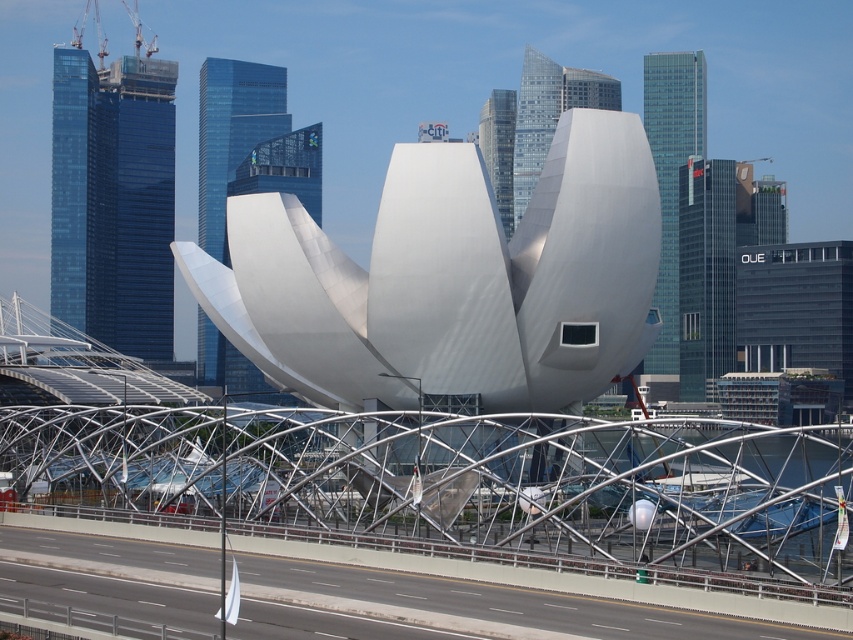
Is metallic silver bridge at center positioned at the back of gray asphalt highway at lower center?

Yes, metallic silver bridge at center is further from the viewer.

Is metallic silver bridge at center thinner than gray asphalt highway at lower center?

No, metallic silver bridge at center is not thinner than gray asphalt highway at lower center.

Which is in front, point (500, 513) or point (741, 630)?

Point (741, 630) is in front.

You are a GUI agent. You are given a task and a screenshot of the screen. Output one action in this format:
    pyautogui.click(x=<x>, y=<y>)
    Task: Click on the metallic silver bridge at center
    This screenshot has height=640, width=853.
    Given the screenshot: What is the action you would take?
    pyautogui.click(x=554, y=484)

Does metallic silver bridge at center have a lesser width compared to satin silver sculpture at center?

No.

Is metallic silver bridge at center to the left of satin silver sculpture at center from the viewer's perspective?

No, metallic silver bridge at center is not to the left of satin silver sculpture at center.

The width and height of the screenshot is (853, 640). Describe the element at coordinates (554, 484) in the screenshot. I see `metallic silver bridge at center` at that location.

Where is `metallic silver bridge at center`? The image size is (853, 640). metallic silver bridge at center is located at coordinates (554, 484).

Does satin silver sculpture at center have a greater height compared to gray asphalt highway at lower center?

Yes, satin silver sculpture at center is taller than gray asphalt highway at lower center.

Is satin silver sculpture at center to the left of gray asphalt highway at lower center from the viewer's perspective?

Incorrect, satin silver sculpture at center is not on the left side of gray asphalt highway at lower center.

The width and height of the screenshot is (853, 640). Identify the location of satin silver sculpture at center. (451, 280).

Image resolution: width=853 pixels, height=640 pixels. Find the location of `satin silver sculpture at center`. satin silver sculpture at center is located at coordinates (451, 280).